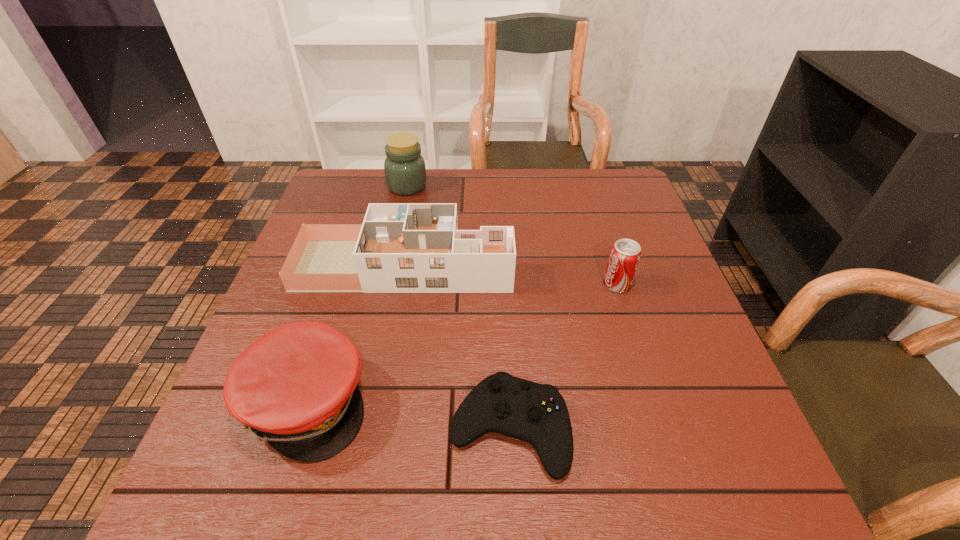
You are a GUI agent. You are given a task and a screenshot of the screen. Output one action in this format:
    pyautogui.click(x=<x>, y=<y>)
    Task: Click on the vacant region located on the left of the control
    This screenshot has height=540, width=960.
    Given the screenshot: What is the action you would take?
    pyautogui.click(x=404, y=429)

Identify the location of object that is at the far edge. (405, 171).

You are a GUI agent. You are given a task and a screenshot of the screen. Output one action in this format:
    pyautogui.click(x=<x>, y=<y>)
    Task: Click on the cap at the near edge
    Image resolution: width=960 pixels, height=540 pixels.
    Given the screenshot: What is the action you would take?
    pyautogui.click(x=295, y=387)

You are a GUI agent. You are given a task and a screenshot of the screen. Output one action in this format:
    pyautogui.click(x=<x>, y=<y>)
    Task: Click on the control situated at the near edge
    The width and height of the screenshot is (960, 540).
    Given the screenshot: What is the action you would take?
    pyautogui.click(x=535, y=413)

Locate an element on the screen. This screenshot has width=960, height=540. dollhouse located at the left edge is located at coordinates (401, 247).

Locate an element on the screen. cap present at the left edge is located at coordinates (295, 387).

Find the location of a particular element. object present at the right edge is located at coordinates (625, 254).

Locate an element on the screen. Image resolution: width=960 pixels, height=540 pixels. object that is at the near left corner is located at coordinates (295, 387).

Locate an element on the screen. This screenshot has height=540, width=960. free spot at the far edge of the desktop is located at coordinates (x=424, y=189).

The height and width of the screenshot is (540, 960). I want to click on vacant space at the near edge of the desktop, so click(x=445, y=471).